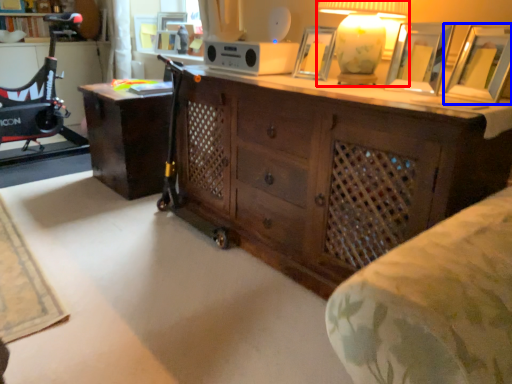
Question: Which object is closer to the camera taking this photo, table lamp (highlighted by a red box) or picture frame (highlighted by a blue box)?

Choices:
 (A) table lamp
 (B) picture frame

Answer: (B)